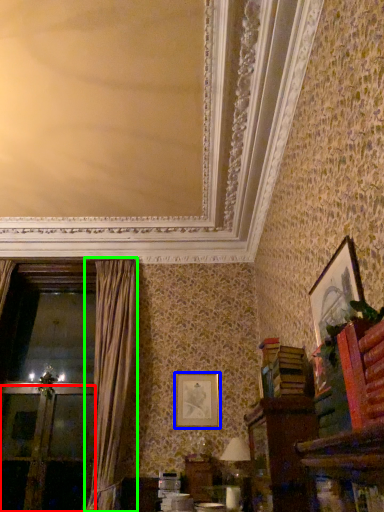
Question: Which object is positioned closest to screen door (highlighted by a red box)? Select from picture frame (highlighted by a blue box) and curtain (highlighted by a green box).

Choices:
 (A) picture frame
 (B) curtain

Answer: (B)